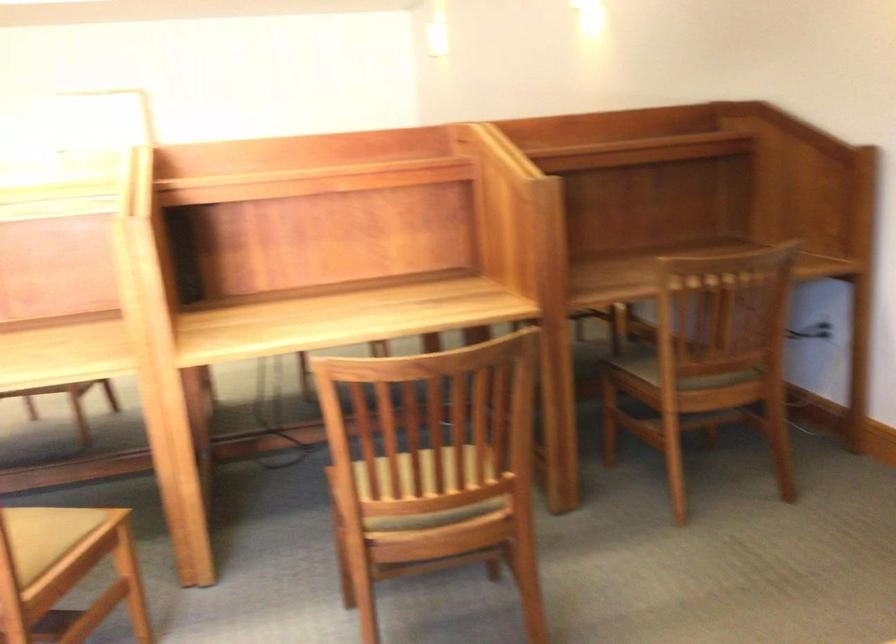
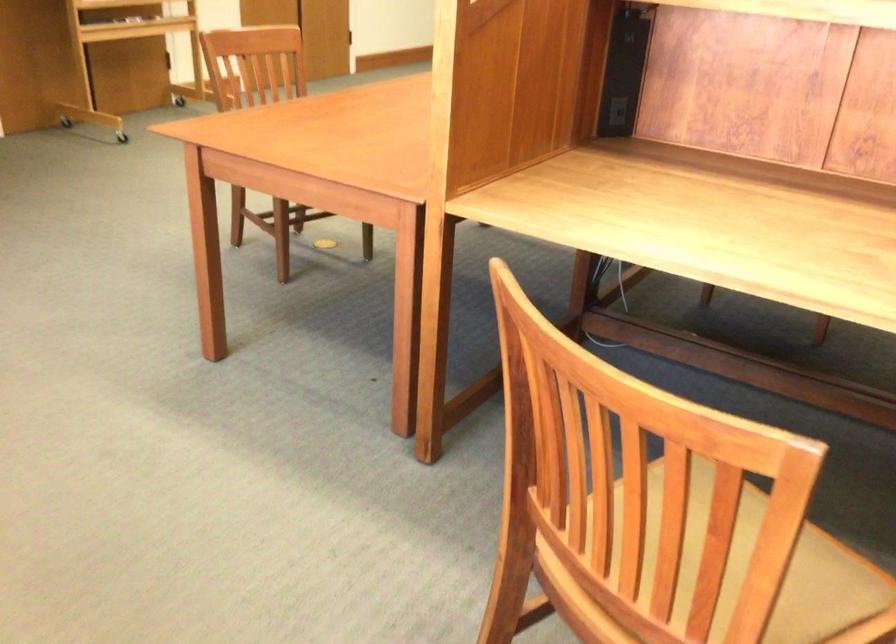
Find the pixel in the second image that matches (x=71, y=534) in the first image.

(833, 594)